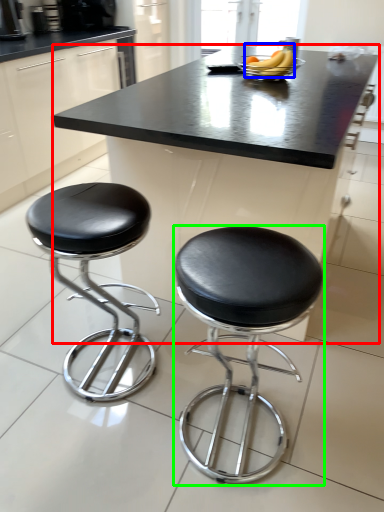
Question: Which object is the farthest from table (highlighted by a red box)? Choose among these: banana (highlighted by a blue box) or stool (highlighted by a green box).

Choices:
 (A) banana
 (B) stool

Answer: (B)